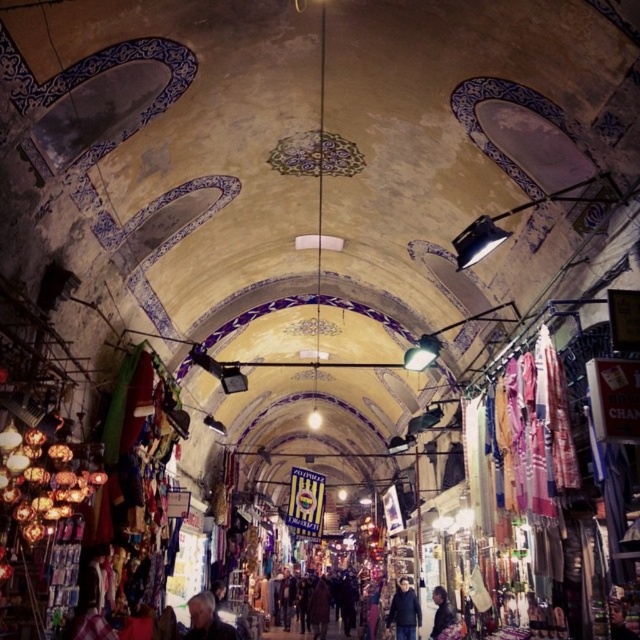
You are a customer in this market and want to buy both jackets. You notice the gray fabric jacket at lower center and the dark brown leather jacket at lower right. Which jacket is positioned more to the left side of the walkway?

The gray fabric jacket at lower center is positioned to the left of the dark brown leather jacket at lower right, so it is more to the left side of the walkway.

You are a customer in the market and want to pick up the gray fabric jacket at lower center and the dark blue jacket at center. Which jacket should you reach for first to grab both efficiently?

You should reach for the gray fabric jacket at lower center first since it is closer to you than the dark blue jacket at center, allowing you to efficiently pick up both items.

You are a customer in a market and see two jackets displayed on a rack. The gray fabric jacket at lower center and the dark brown leather jacket at lower right. Which jacket is placed higher on the rack?

The gray fabric jacket at lower center is located above the dark brown leather jacket at lower right, so it is placed higher on the rack.